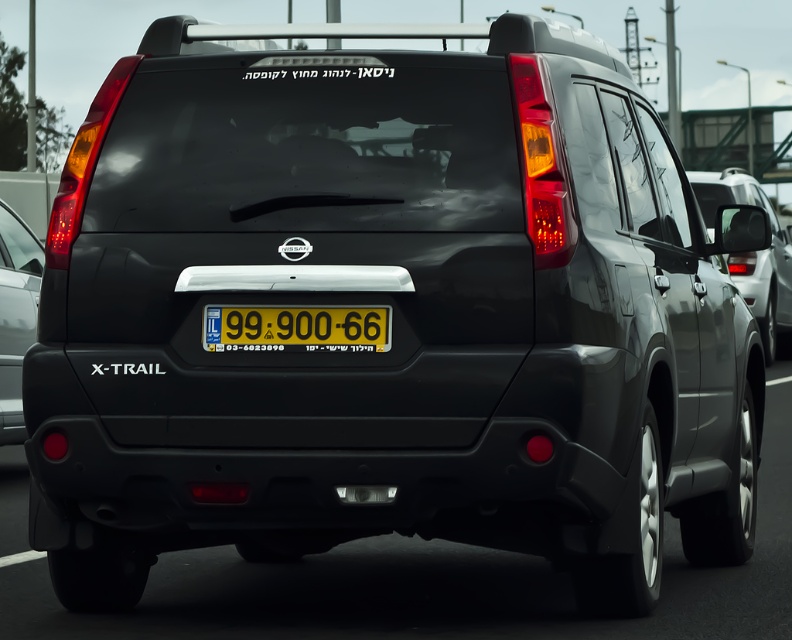
Which is more to the left, yellow plastic license plate at center or matte black tail light at lower left?

From the viewer's perspective, matte black tail light at lower left appears more on the left side.

Consider the image. Who is positioned more to the right, yellow plastic license plate at center or matte black tail light at lower left?

yellow plastic license plate at center is more to the right.

The width and height of the screenshot is (792, 640). What do you see at coordinates (297, 326) in the screenshot?
I see `yellow plastic license plate at center` at bounding box center [297, 326].

What are the coordinates of `yellow plastic license plate at center` in the screenshot? It's located at (297, 326).

Describe the element at coordinates (752, 253) in the screenshot. The height and width of the screenshot is (640, 792). I see `satin black suv at right` at that location.

Where is `satin black suv at right`? This screenshot has height=640, width=792. satin black suv at right is located at coordinates (752, 253).

Who is positioned more to the right, yellow plastic license plate at center or satin black suv at right?

From the viewer's perspective, satin black suv at right appears more on the right side.

Locate an element on the screen. yellow plastic license plate at center is located at coordinates (297, 326).